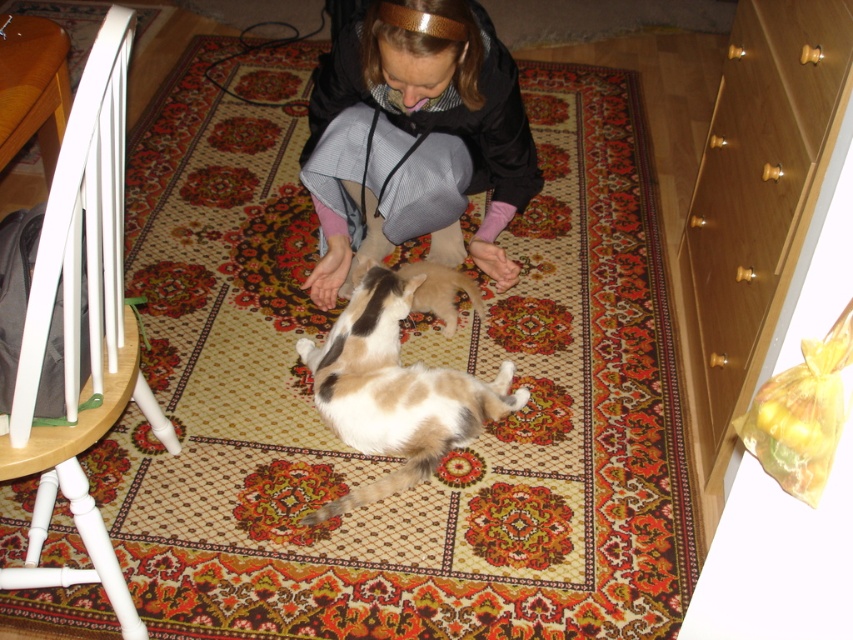
Question: Is light brown wood drawer at right to the left of black hoodie at center from the viewer's perspective?

Choices:
 (A) yes
 (B) no

Answer: (B)

Question: Which object is the closest to the brown and white fur cat at center?

Choices:
 (A) black hoodie at center
 (B) light brown wood drawer at right

Answer: (A)

Question: Which point is closer to the camera?

Choices:
 (A) brown and white fur cat at center
 (B) light brown wood drawer at right
 (C) black hoodie at center

Answer: (B)

Question: Estimate the real-world distances between objects in this image. Which object is farther from the black hoodie at center?

Choices:
 (A) brown and white fur cat at center
 (B) light brown wood drawer at right

Answer: (B)

Question: Is light brown wood drawer at right thinner than brown and white fur cat at center?

Choices:
 (A) no
 (B) yes

Answer: (B)

Question: Is the position of black hoodie at center more distant than that of brown and white fur cat at center?

Choices:
 (A) no
 (B) yes

Answer: (A)